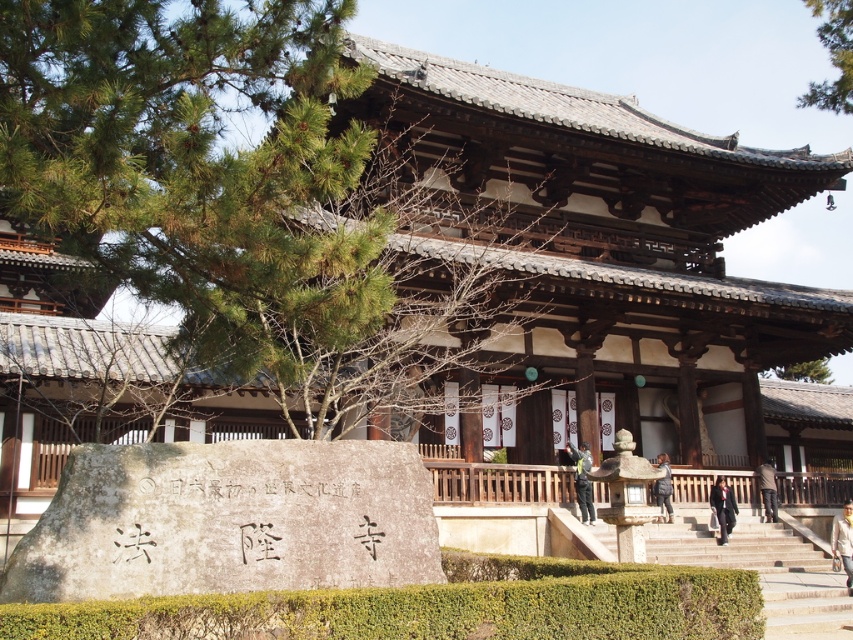
Is light brown leather jacket at lower right bigger than dark brown wood at right?

Correct, light brown leather jacket at lower right is larger in size than dark brown wood at right.

Based on the photo, which is above, light brown leather jacket at lower right or dark brown wood at right?

dark brown wood at right

Where is `light brown leather jacket at lower right`? The height and width of the screenshot is (640, 853). light brown leather jacket at lower right is located at coordinates (843, 540).

Is dark green fabric jacket at center positioned at the back of light brown leather jacket at lower right?

Yes, it is behind light brown leather jacket at lower right.

Is dark green fabric jacket at center closer to camera compared to light brown leather jacket at lower right?

No, it is not.

This screenshot has height=640, width=853. Identify the location of dark green fabric jacket at center. (582, 480).

Can you confirm if light brown leather jacket at lower right is thinner than black fabric coat at center?

Incorrect, light brown leather jacket at lower right's width is not less than black fabric coat at center's.

Who is shorter, light brown leather jacket at lower right or black fabric coat at center?

black fabric coat at center

At what (x,y) coordinates should I click in order to perform the action: click on light brown leather jacket at lower right. Please return your answer as a coordinate pair (x, y). This screenshot has width=853, height=640. Looking at the image, I should click on (843, 540).